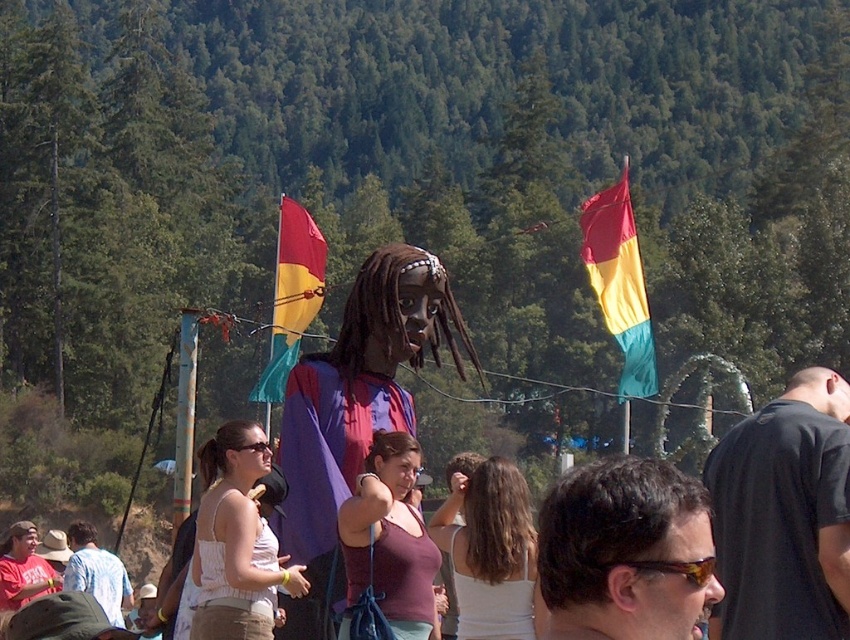
Which of these two, red/yellow/green fabric flag at upper right or red fabric flag at center, stands shorter?

With less height is red fabric flag at center.

Which is behind, point (592, 205) or point (292, 273)?

The point (592, 205) is more distant.

Does point (596, 243) come behind point (287, 276)?

Yes.

You are a GUI agent. You are given a task and a screenshot of the screen. Output one action in this format:
    pyautogui.click(x=<x>, y=<y>)
    Task: Click on the red/yellow/green fabric flag at upper right
    This screenshot has width=850, height=640.
    Given the screenshot: What is the action you would take?
    pyautogui.click(x=619, y=284)

Is red/yellow/green fabric flag at upper right taller than white lace tank top at center?

Yes, red/yellow/green fabric flag at upper right is taller than white lace tank top at center.

Based on the photo, does red/yellow/green fabric flag at upper right have a lesser width compared to white lace tank top at center?

No.

Which is behind, point (596, 288) or point (205, 621)?

The point (596, 288) is behind.

At what (x,y) coordinates should I click in order to perform the action: click on red/yellow/green fabric flag at upper right. Please return your answer as a coordinate pair (x, y). This screenshot has height=640, width=850. Looking at the image, I should click on (619, 284).

Is red fabric flag at center positioned at the back of matte white t-shirt at lower left?

Yes, it is behind matte white t-shirt at lower left.

Which of these two, red fabric flag at center or matte white t-shirt at lower left, stands taller?

With more height is red fabric flag at center.

I want to click on red fabric flag at center, so click(x=292, y=296).

Where is `red fabric flag at center`? The width and height of the screenshot is (850, 640). red fabric flag at center is located at coordinates (292, 296).